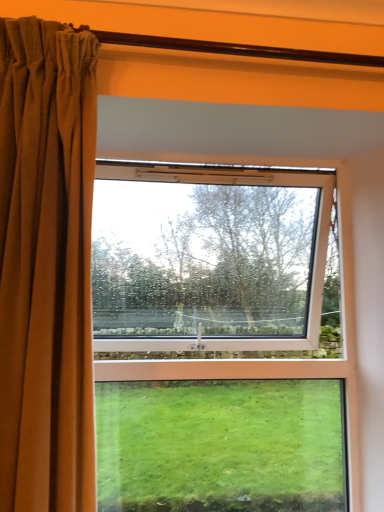
Question: Considering the relative positions of brown velvet curtain at left and clear glass window at center in the image provided, is brown velvet curtain at left to the left or to the right of clear glass window at center?

Choices:
 (A) right
 (B) left

Answer: (B)

Question: From the image's perspective, is brown velvet curtain at left positioned above or below clear glass window at center?

Choices:
 (A) above
 (B) below

Answer: (A)

Question: Is brown velvet curtain at left situated inside clear glass window at center or outside?

Choices:
 (A) outside
 (B) inside

Answer: (A)

Question: Is point (311, 294) positioned closer to the camera than point (87, 382)?

Choices:
 (A) closer
 (B) farther

Answer: (B)

Question: From a real-world perspective, is clear glass window at center above or below brown velvet curtain at left?

Choices:
 (A) below
 (B) above

Answer: (A)

Question: Is clear glass window at center situated inside brown velvet curtain at left or outside?

Choices:
 (A) inside
 (B) outside

Answer: (B)

Question: In terms of size, does clear glass window at center appear bigger or smaller than brown velvet curtain at left?

Choices:
 (A) big
 (B) small

Answer: (A)